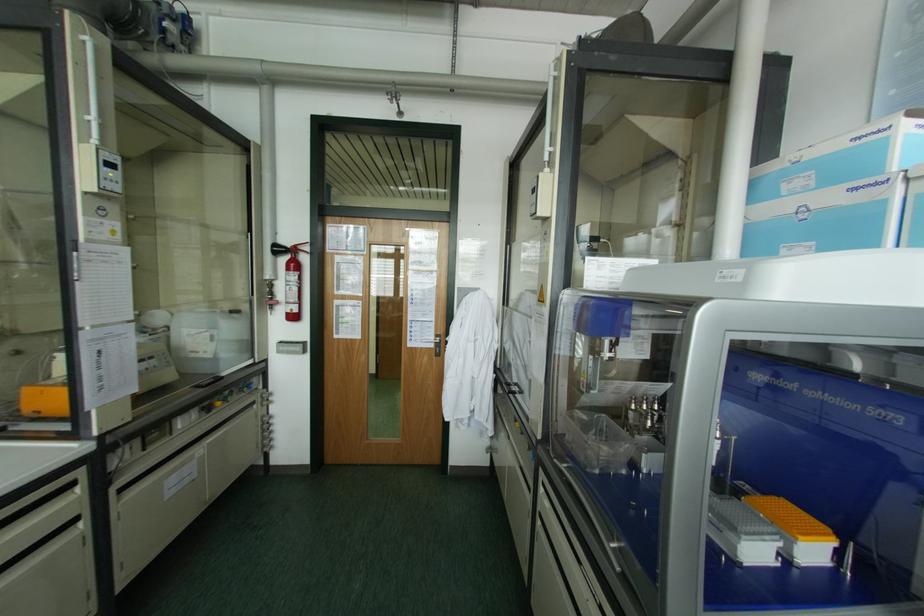
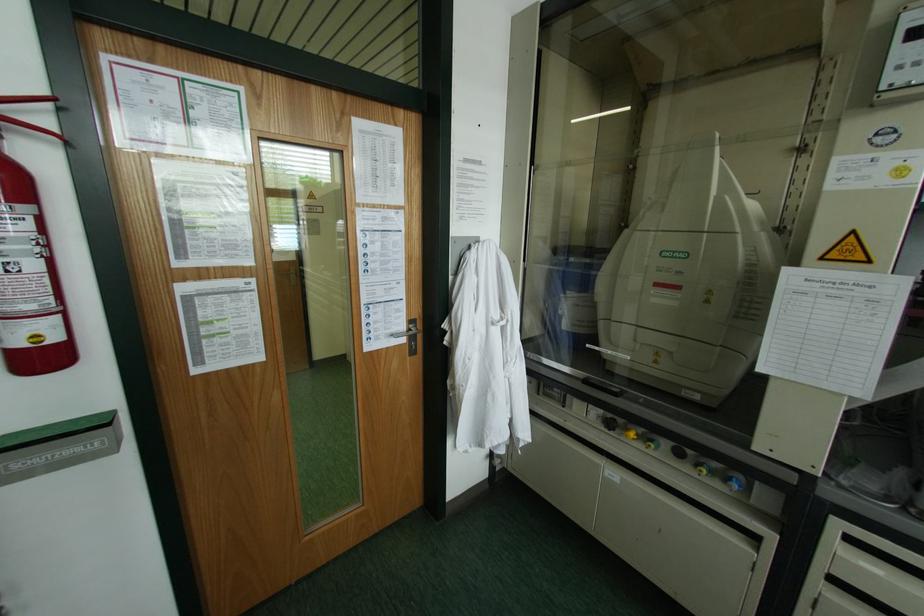
Find the pixel in the second image that matches (445,342) in the first image.

(444, 331)